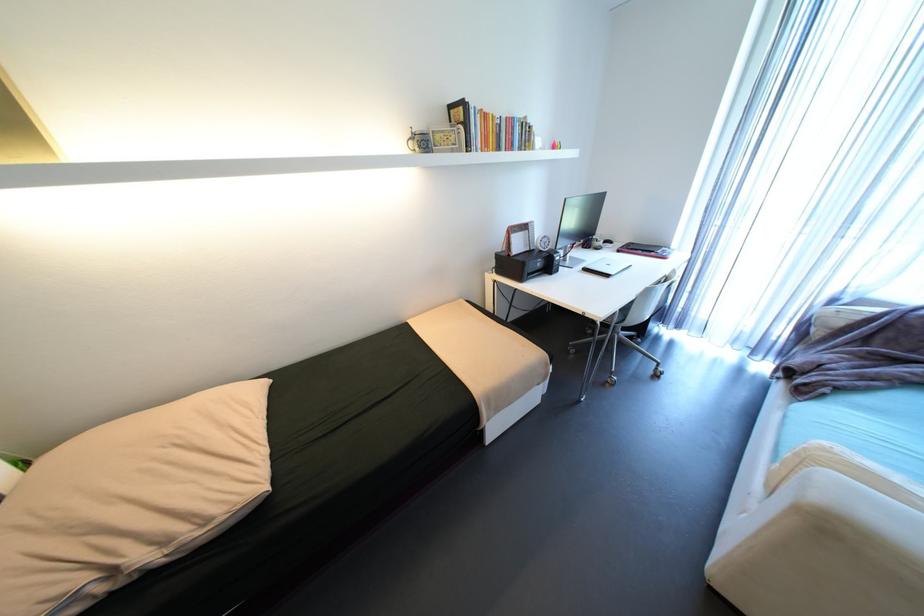
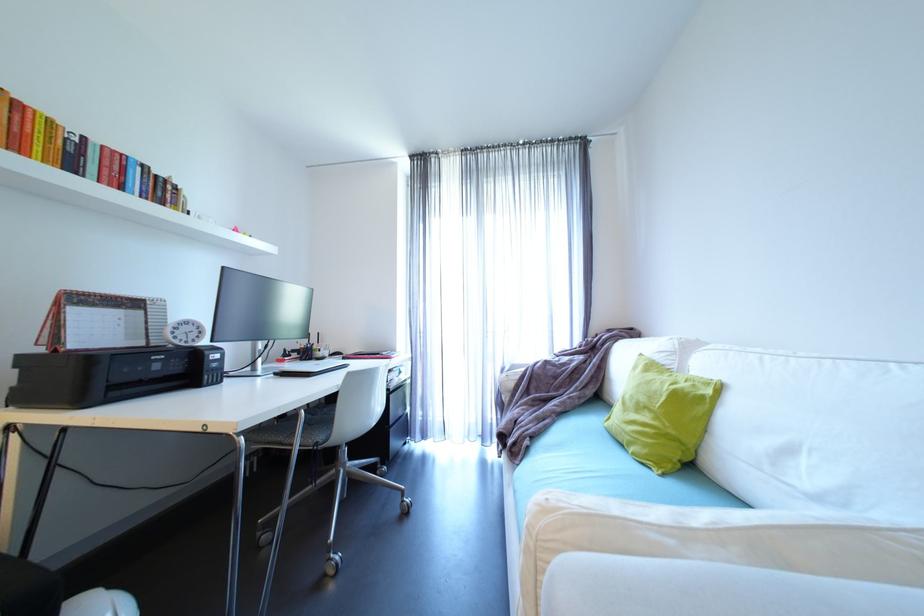
How did the camera likely rotate?

The rotation direction of the camera is right-up.